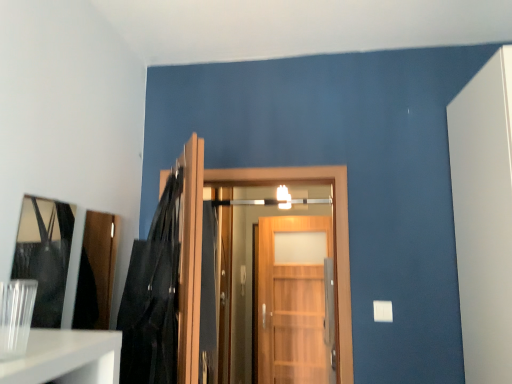
This screenshot has height=384, width=512. What are the coordinates of `satin silver door handle at center` in the screenshot? It's located at (243, 279).

Measure the distance between matte black mirror at left and camera.

They are 1.81 meters apart.

Locate an element on the screen. This screenshot has height=384, width=512. wooden door at center, the first door viewed from the back is located at coordinates (293, 300).

The width and height of the screenshot is (512, 384). What do you see at coordinates (334, 231) in the screenshot? I see `wooden door at center, placed as the 2th door when sorted from front to back` at bounding box center [334, 231].

This screenshot has height=384, width=512. In order to click on satin silver door handle at center in this screenshot , I will do `click(243, 279)`.

Which object is positioned more to the right, satin silver door handle at center or wooden door at center, which is the 2th door from back to front?

Positioned to the right is wooden door at center, which is the 2th door from back to front.

Consider the image. Are satin silver door handle at center and wooden door at center, placed as the 2th door when sorted from front to back, far apart?

satin silver door handle at center is positioned a significant distance from wooden door at center, placed as the 2th door when sorted from front to back.

Does satin silver door handle at center have a lesser height compared to wooden door at center, which is the 2th door from back to front?

Correct, satin silver door handle at center is not as tall as wooden door at center, which is the 2th door from back to front.

From the image's perspective, which one is positioned lower, satin silver door handle at center or wooden door at center, placed as the 2th door when sorted from front to back?

satin silver door handle at center.

Is wooden door at center, the first door viewed from the back, positioned with its back to satin silver door handle at center?

That's not correct — wooden door at center, the first door viewed from the back, is not looking away from satin silver door handle at center.

Which of these two, wooden door at center, positioned as the third door in front-to-back order, or satin silver door handle at center, is smaller?

satin silver door handle at center.

Can you confirm if wooden door at center, positioned as the third door in front-to-back order, is thinner than satin silver door handle at center?

No, wooden door at center, positioned as the third door in front-to-back order, is not thinner than satin silver door handle at center.

Find the location of `door handle that appears below the wooden door at center, positioned as the third door in front-to-back order (from the image's perspective)`. door handle that appears below the wooden door at center, positioned as the third door in front-to-back order (from the image's perspective) is located at coordinates (243, 279).

Looking at this image, is black leather jacket at upper left oriented away from wooden door at center, the 1th door from the front?

Yes, black leather jacket at upper left is facing away from wooden door at center, the 1th door from the front.

What's the angular difference between black leather jacket at upper left and wooden door at center, the 1th door from the front,'s facing directions?

1.02 degrees separate the facing orientations of black leather jacket at upper left and wooden door at center, the 1th door from the front.

Could you measure the distance between black leather jacket at upper left and wooden door at center, arranged as the 3th door when viewed from the back?

black leather jacket at upper left is 6.64 inches away from wooden door at center, arranged as the 3th door when viewed from the back.

From the image's perspective, does black leather jacket at upper left appear higher than wooden door at center, the 1th door from the front?

Correct, black leather jacket at upper left appears higher than wooden door at center, the 1th door from the front, in the image.

From the image's perspective, is matte black mirror at left beneath wooden door at center, the first door viewed from the back?

No, from the image's perspective, matte black mirror at left is not beneath wooden door at center, the first door viewed from the back.

Based on their sizes in the image, would you say matte black mirror at left is bigger or smaller than wooden door at center, the first door viewed from the back?

matte black mirror at left is smaller than wooden door at center, the first door viewed from the back.

How many degrees apart are the facing directions of matte black mirror at left and wooden door at center, positioned as the third door in front-to-back order?

The angle between the facing direction of matte black mirror at left and the facing direction of wooden door at center, positioned as the third door in front-to-back order, is 96.5 degrees.

Looking at the image, does wooden door at center, arranged as the 3th door when viewed from the back, seem bigger or smaller compared to wooden door at center, which is the 2th door from back to front?

Considering their sizes, wooden door at center, arranged as the 3th door when viewed from the back, takes up less space than wooden door at center, which is the 2th door from back to front.

Is wooden door at center, the 1th door from the front, facing away from wooden door at center, placed as the 2th door when sorted from front to back?

No, wooden door at center, placed as the 2th door when sorted from front to back, is not at the back of wooden door at center, the 1th door from the front.

Which is behind, point (178, 349) or point (353, 378)?

Point (353, 378)

Which object is closer to the camera, wooden door at center, the 1th door from the front, or wooden door at center, which is the 2th door from back to front?

wooden door at center, the 1th door from the front.

How much distance is there between wooden door at center, the 1th door from the front, and black leather jacket at upper left?

6.64 inches.

Can you see wooden door at center, the 1th door from the front, touching black leather jacket at upper left?

No, wooden door at center, the 1th door from the front, is not touching black leather jacket at upper left.

From the image's perspective, which is above, wooden door at center, arranged as the 3th door when viewed from the back, or black leather jacket at upper left?

From the image's view, black leather jacket at upper left is above.

Would you say wooden door at center, arranged as the 3th door when viewed from the back, is outside black leather jacket at upper left?

Yes.

Does black leather jacket at upper left have a lesser width compared to transparent glass vase at lower left?

No.

Considering the points (169, 204) and (16, 328), which point is in front, point (169, 204) or point (16, 328)?

The point (16, 328) is closer.

Which object is further away from the camera, black leather jacket at upper left or transparent glass vase at lower left?

black leather jacket at upper left.

I want to click on door handle behind the wooden door at center, which is the 2th door from back to front, so click(x=243, y=279).

In order to click on the 2nd door to the right of the satin silver door handle at center, counting from the anchor's position in this screenshot , I will do `click(293, 300)`.

When comparing their distances from wooden door at center, which is the 2th door from back to front, does wooden door at center, positioned as the third door in front-to-back order, or wooden door at center, the 1th door from the front, seem closer?

Among the two, wooden door at center, the 1th door from the front, is located nearer to wooden door at center, which is the 2th door from back to front.

Considering their positions, is satin silver door handle at center positioned closer to wooden door at center, which is the 2th door from back to front, than matte black mirror at left?

Among the two, matte black mirror at left is located nearer to wooden door at center, which is the 2th door from back to front.

Based on the photo, from the image, which object appears to be farther from wooden door at center, which is the 2th door from back to front, transparent glass vase at lower left or black leather jacket at upper left?

transparent glass vase at lower left is positioned further to the anchor wooden door at center, which is the 2th door from back to front.

Considering their positions, is matte black mirror at left positioned further to wooden door at center, positioned as the third door in front-to-back order, than wooden door at center, arranged as the 3th door when viewed from the back?

wooden door at center, arranged as the 3th door when viewed from the back.

Which object lies further to the anchor point satin silver door handle at center, wooden door at center, placed as the 2th door when sorted from front to back, or wooden door at center, the first door viewed from the back?

wooden door at center, placed as the 2th door when sorted from front to back, lies further to satin silver door handle at center than the other object.

Based on their spatial positions, is wooden door at center, the 1th door from the front, or satin silver door handle at center further from matte black mirror at left?

satin silver door handle at center is positioned further to the anchor matte black mirror at left.

Which object lies further to the anchor point black leather jacket at upper left, satin silver door handle at center or wooden door at center, which is the 2th door from back to front?

satin silver door handle at center is positioned further to the anchor black leather jacket at upper left.

Which object lies nearer to the anchor point matte black mirror at left, wooden door at center, the first door viewed from the back, or transparent glass vase at lower left?

Among the two, transparent glass vase at lower left is located nearer to matte black mirror at left.

This screenshot has height=384, width=512. What are the coordinates of `door between transparent glass vase at lower left and black leather jacket at upper left from front to back` in the screenshot? It's located at (190, 260).

At what (x,y) coordinates should I click in order to perform the action: click on cabinetry positioned between wooden door at center, arranged as the 3th door when viewed from the back, and wooden door at center, positioned as the third door in front-to-back order, from near to far. Please return your answer as a coordinate pair (x, y). This screenshot has height=384, width=512. Looking at the image, I should click on (96, 272).

Where is `dark between wooden door at center, the 1th door from the front, and matte black mirror at left in the front-back direction`? This screenshot has height=384, width=512. dark between wooden door at center, the 1th door from the front, and matte black mirror at left in the front-back direction is located at coordinates (153, 296).

Find the location of `dark between wooden door at center, arranged as the 3th door when viewed from the back, and wooden door at center, placed as the 2th door when sorted from front to back, in the front-back direction`. dark between wooden door at center, arranged as the 3th door when viewed from the back, and wooden door at center, placed as the 2th door when sorted from front to back, in the front-back direction is located at coordinates (153, 296).